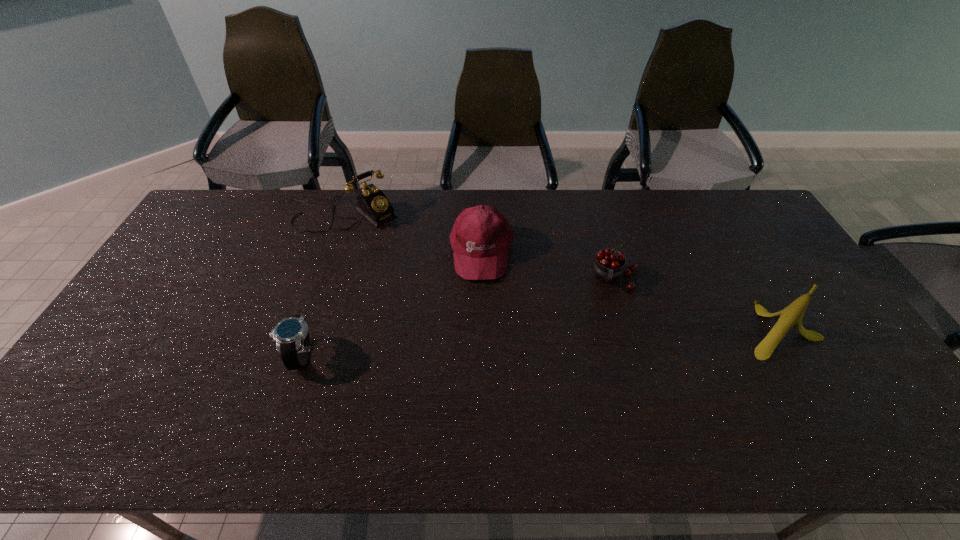
Identify the location of free space between the third object from left to right and the telephone. This screenshot has width=960, height=540. (415, 233).

Identify the location of unoccupied area between the watch and the telephone. (324, 285).

Identify the location of free spot between the third object from left to right and the shortest object. tap(392, 303).

Select which object appears as the second closest to the third object from left to right. Please provide its 2D coordinates. Your answer should be formatted as a tuple, i.e. [(x, y)], where the tuple contains the x and y coordinates of a point satisfying the conditions above.

[(608, 267)]

Find the location of a particular element. Image resolution: width=960 pixels, height=540 pixels. object that ranks as the fourth closest to the fourth object from left to right is located at coordinates (291, 335).

At what (x,y) coordinates should I click in order to perform the action: click on free space in the image that satisfies the following two spatial constraints: 1. on the back side of the fourth object from left to right; 2. on the left side of the watch. Please return your answer as a coordinate pair (x, y). Looking at the image, I should click on (326, 278).

Locate an element on the screen. vacant space that satisfies the following two spatial constraints: 1. on the front side of the third object from left to right; 2. on the right side of the second object from right to left is located at coordinates (482, 278).

Where is `free spot that satisfies the following two spatial constraints: 1. on the front side of the third object from right to left; 2. on the right side of the telephone`? The image size is (960, 540). free spot that satisfies the following two spatial constraints: 1. on the front side of the third object from right to left; 2. on the right side of the telephone is located at coordinates (335, 251).